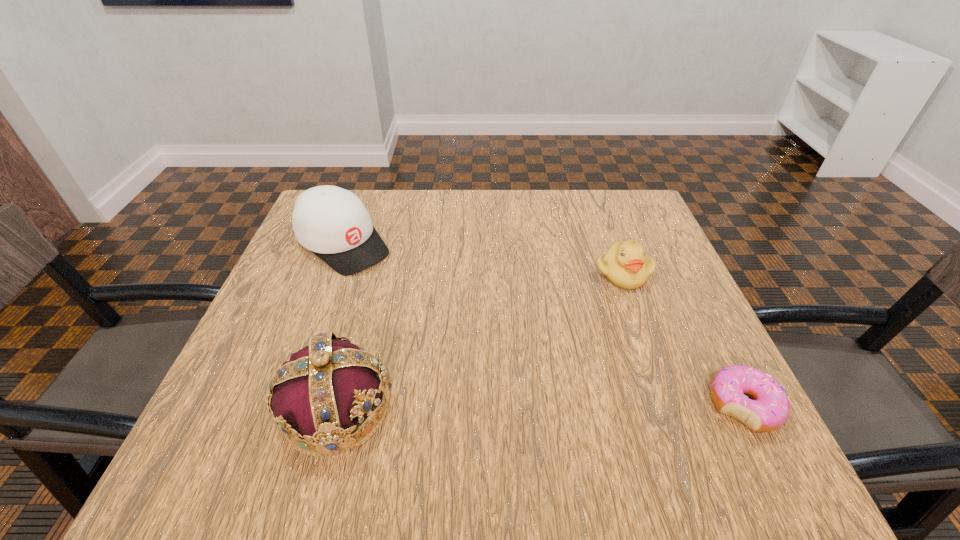
This screenshot has height=540, width=960. Identify the location of crown. (319, 395).

Where is `the rightmost object`? the rightmost object is located at coordinates (769, 410).

Where is `the shortest object`? This screenshot has height=540, width=960. the shortest object is located at coordinates (769, 410).

This screenshot has width=960, height=540. I want to click on baseball cap, so click(x=333, y=223).

Where is `the second shortest object`? The width and height of the screenshot is (960, 540). the second shortest object is located at coordinates (625, 265).

You are a GUI agent. You are given a task and a screenshot of the screen. Output one action in this format:
    pyautogui.click(x=<x>, y=<y>)
    Task: Click on the third object from left to right
    The image size is (960, 540).
    Given the screenshot: What is the action you would take?
    pyautogui.click(x=625, y=265)

You are a GUI agent. You are given a task and a screenshot of the screen. Output one action in this format:
    pyautogui.click(x=<x>, y=<y>)
    Task: Click on the vacant space located 0.320m on the back of the crown
    This screenshot has height=540, width=960.
    Given the screenshot: What is the action you would take?
    pyautogui.click(x=378, y=253)

Find the location of a particular element. free region located 0.080m on the left of the rightmost object is located at coordinates (660, 406).

Locate an element on the screen. vacant space situated on the front-facing side of the baseball cap is located at coordinates point(487,356).

The image size is (960, 540). What are the coordinates of `vacant space positioned on the front-facing side of the baseball cap` in the screenshot? It's located at (447, 326).